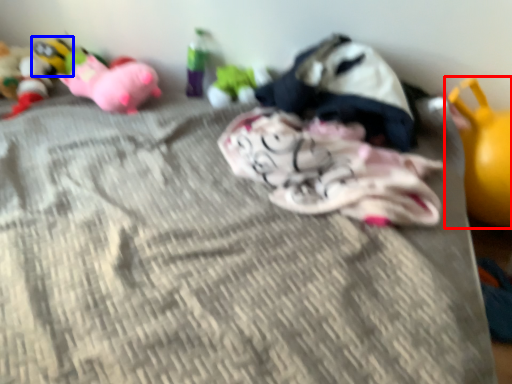
Question: Which point is further to the camera, toy (highlighted by a red box) or toy (highlighted by a blue box)?

Choices:
 (A) toy
 (B) toy

Answer: (B)